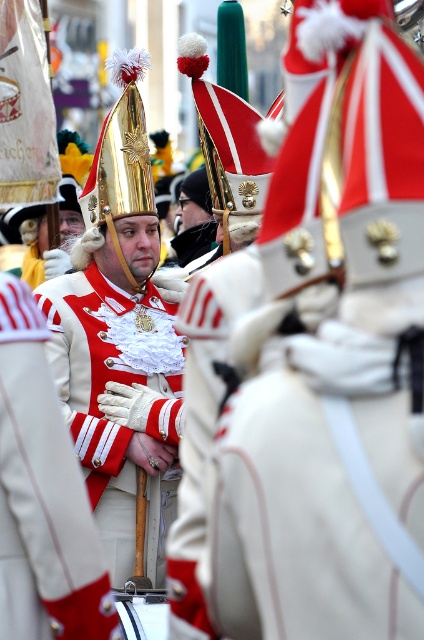
You are observing a historical parade and notice two points marked in the image. The first point is at coordinates point (2,580) and the second is at point (81,301). Which of these two points is closer to the viewer?

Point (2,580) is in front of point (81,301), so it is closer to the viewer.

You are a photographer trying to capture the central figures in the parade. You notice two uniforms at the center of the image. Which one is positioned to the left when looking at the white matte uniform at center and the white satin uniform at center?

The white matte uniform at center is positioned to the left of the white satin uniform at center.